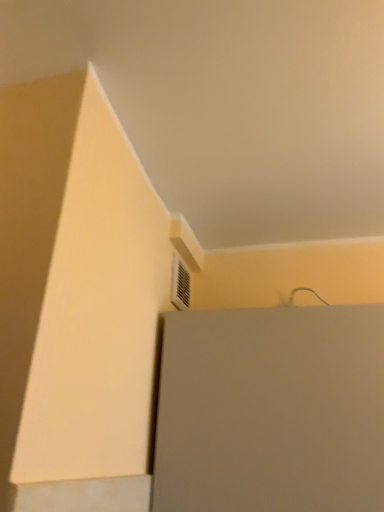
Describe the element at coordinates (180, 284) in the screenshot. I see `white plastic air conditioning at upper center` at that location.

What is the approximate width of white plastic air conditioning at upper center?

white plastic air conditioning at upper center is 0.58 inches in width.

In order to click on white plastic air conditioning at upper center in this screenshot , I will do `click(180, 284)`.

Find the location of a particular element. This screenshot has height=512, width=384. white plastic air conditioning at upper center is located at coordinates (180, 284).